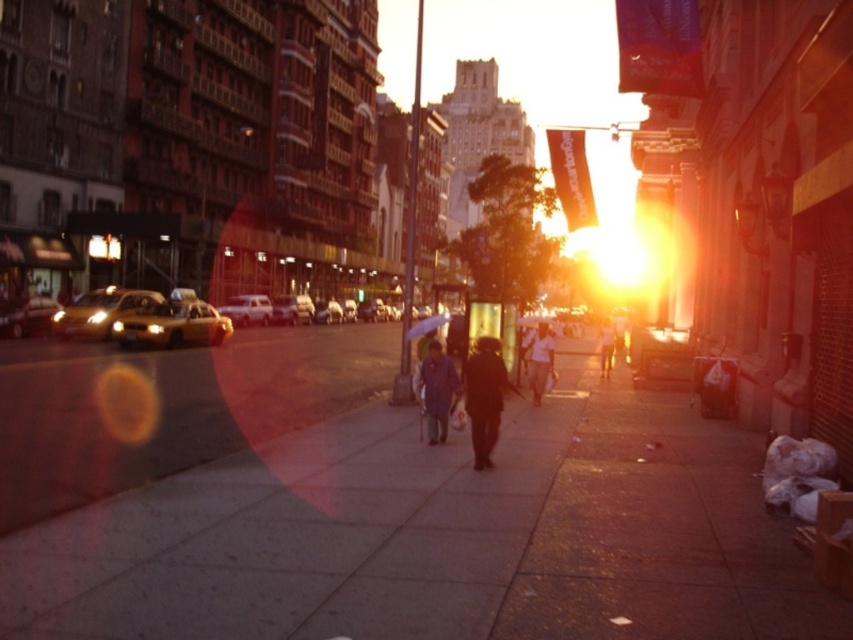
What are the coordinates of `brown leather jacket at center` in the screenshot? It's located at (437, 392).

From the picture: Can you confirm if brown leather jacket at center is bigger than shiny metallic car at left?

Correct, brown leather jacket at center is larger in size than shiny metallic car at left.

Does point (442, 353) come in front of point (45, 332)?

Yes, point (442, 353) is in front of point (45, 332).

Locate an element on the screen. brown leather jacket at center is located at coordinates coord(437,392).

Does point (206, 323) lie in front of point (408, 333)?

No.

Find the location of a particular element. The width and height of the screenshot is (853, 640). yellow rubber taxi at left is located at coordinates (173, 324).

Between yellow metallic taxi at center-left and dark gray jacket at center, which one appears on the right side from the viewer's perspective?

dark gray jacket at center is more to the right.

Who is more forward, (62, 326) or (613, 353)?

Positioned in front is point (613, 353).

Is point (148, 308) farther from camera compared to point (606, 369)?

That is True.

Locate an element on the screen. The height and width of the screenshot is (640, 853). yellow metallic taxi at center-left is located at coordinates (102, 310).